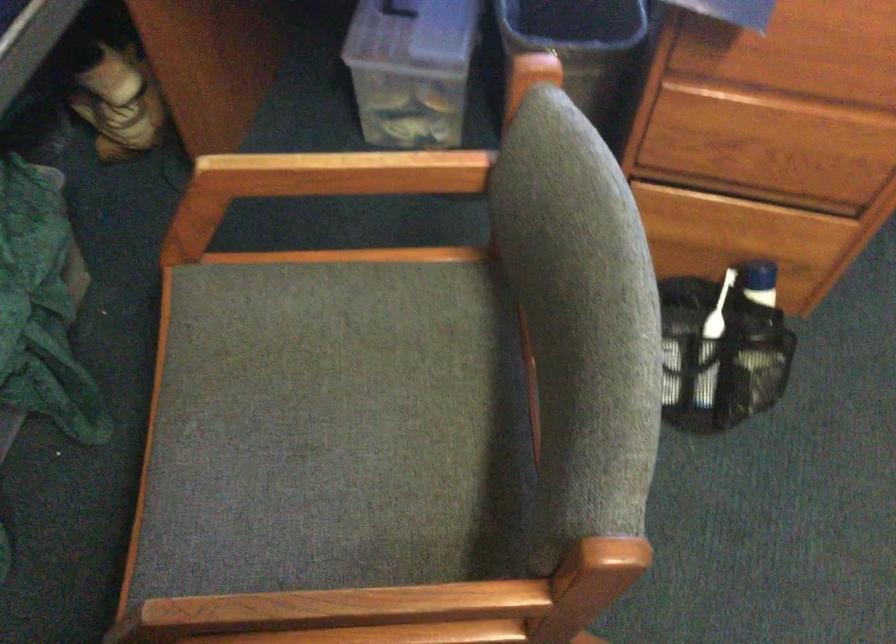
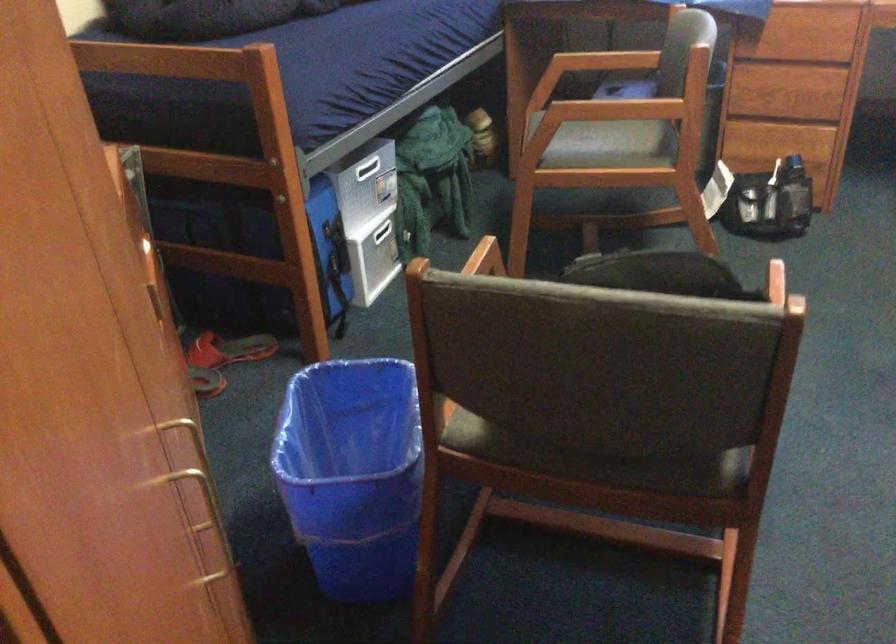
The point at (819, 97) is marked in the first image. Where is the corresponding point in the second image?

(803, 46)